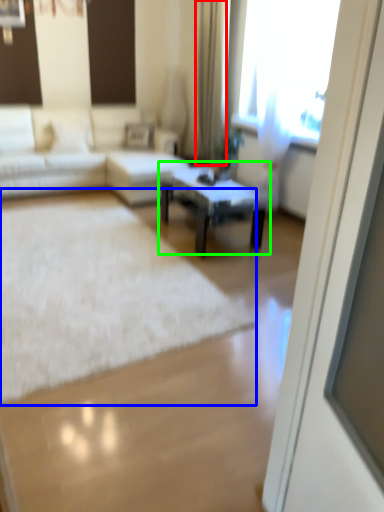
Question: Which is nearer to the curtain (highlighted by a red box)? mat (highlighted by a blue box) or coffee table (highlighted by a green box).

Choices:
 (A) mat
 (B) coffee table

Answer: (B)